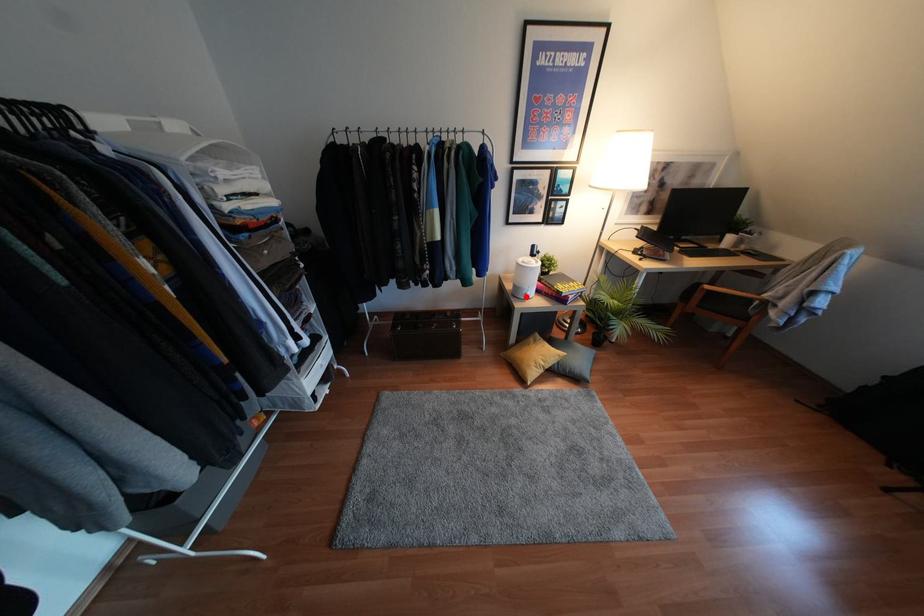
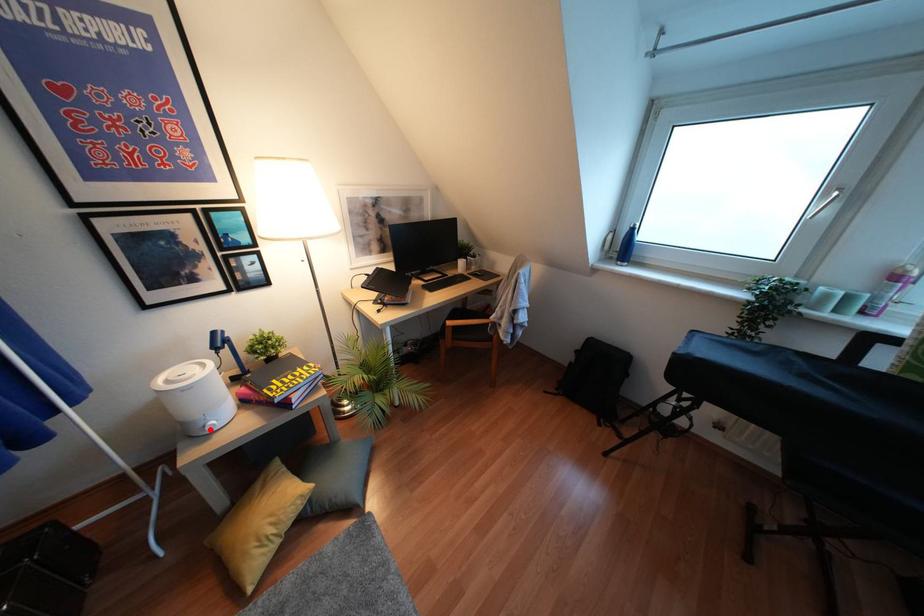
I am providing you with two images of the same scene from different viewpoints. A red point is marked on the first image and another point is marked on the second image. Are the points marked in image1 and image2 representing the same 3D position?

Yes